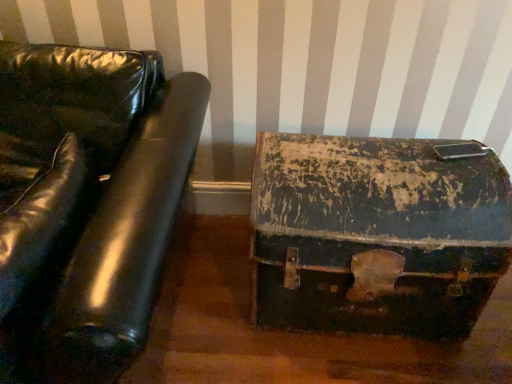
Question: Is black leather couch at left positioned far away from rusty leather suitcase at lower right?

Choices:
 (A) yes
 (B) no

Answer: (B)

Question: Is black leather couch at left further to the viewer compared to rusty leather suitcase at lower right?

Choices:
 (A) no
 (B) yes

Answer: (A)

Question: Is the surface of black leather couch at left in direct contact with rusty leather suitcase at lower right?

Choices:
 (A) no
 (B) yes

Answer: (A)

Question: Is black leather couch at left not inside rusty leather suitcase at lower right?

Choices:
 (A) no
 (B) yes

Answer: (B)

Question: Considering the relative sizes of black leather couch at left and rusty leather suitcase at lower right in the image provided, is black leather couch at left smaller than rusty leather suitcase at lower right?

Choices:
 (A) yes
 (B) no

Answer: (B)

Question: From a real-world perspective, is black leather couch at left on top of rusty leather suitcase at lower right?

Choices:
 (A) yes
 (B) no

Answer: (A)

Question: Does rusty leather suitcase at lower right have a larger size compared to black leather couch at left?

Choices:
 (A) no
 (B) yes

Answer: (A)

Question: Can you confirm if rusty leather suitcase at lower right is taller than black leather couch at left?

Choices:
 (A) yes
 (B) no

Answer: (B)

Question: Is rusty leather suitcase at lower right thinner than black leather couch at left?

Choices:
 (A) no
 (B) yes

Answer: (B)

Question: Is rusty leather suitcase at lower right at the left side of black leather couch at left?

Choices:
 (A) yes
 (B) no

Answer: (B)

Question: Is there a large distance between rusty leather suitcase at lower right and black leather couch at left?

Choices:
 (A) no
 (B) yes

Answer: (A)

Question: From a real-world perspective, is rusty leather suitcase at lower right under black leather couch at left?

Choices:
 (A) no
 (B) yes

Answer: (B)

Question: From their relative heights in the image, would you say rusty leather suitcase at lower right is taller or shorter than black leather couch at left?

Choices:
 (A) tall
 (B) short

Answer: (B)